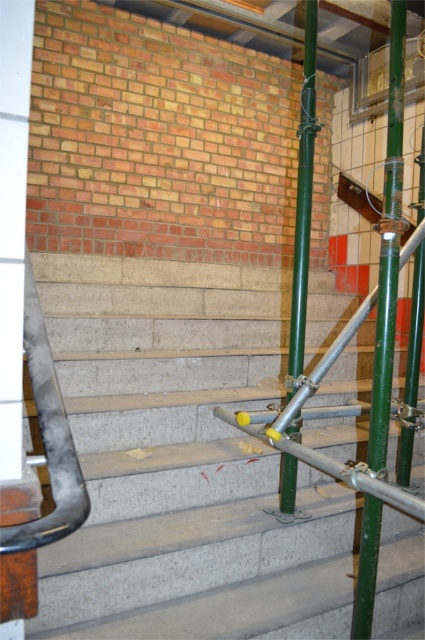
Question: Which object appears farthest from the camera in this image?

Choices:
 (A) green metallic pole at right
 (B) concrete stairs at center

Answer: (A)

Question: Which point is closer to the camera taking this photo?

Choices:
 (A) (294, 349)
 (B) (244, 518)

Answer: (B)

Question: Is green metallic pole at right further to camera compared to green metallic pole at center?

Choices:
 (A) yes
 (B) no

Answer: (B)

Question: Among these objects, which one is nearest to the camera?

Choices:
 (A) concrete stairs at center
 (B) green metallic pole at right

Answer: (A)

Question: Does concrete stairs at center appear over green metallic pole at right?

Choices:
 (A) no
 (B) yes

Answer: (A)

Question: In this image, where is concrete stairs at center located relative to green metallic pole at center?

Choices:
 (A) below
 (B) above

Answer: (A)